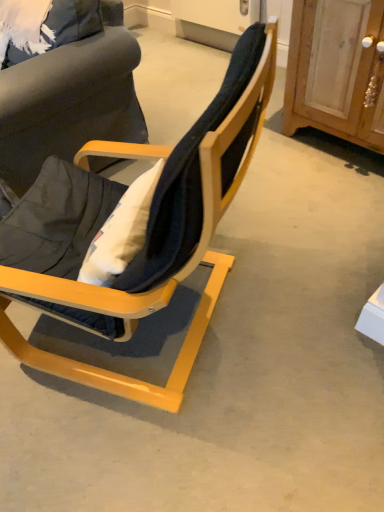
Locate an element on the screen. The height and width of the screenshot is (512, 384). vacant area situated below wooden rocking chair at center (from a real-world perspective) is located at coordinates (162, 333).